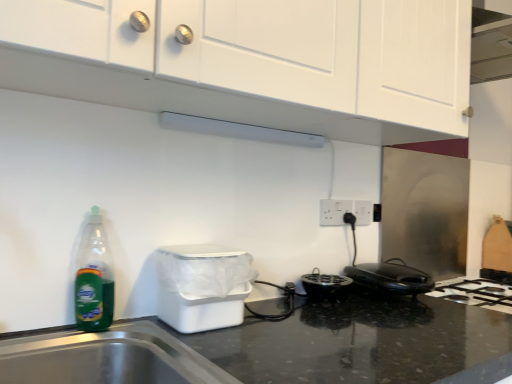
Question: From the image's perspective, does white plastic trash bin at lower left appear higher than white matte cabinet at upper center?

Choices:
 (A) yes
 (B) no

Answer: (B)

Question: Does white plastic trash bin at lower left come behind white matte cabinet at upper center?

Choices:
 (A) yes
 (B) no

Answer: (A)

Question: Can you confirm if white plastic trash bin at lower left is wider than white matte cabinet at upper center?

Choices:
 (A) yes
 (B) no

Answer: (B)

Question: From a real-world perspective, is white plastic trash bin at lower left located higher than white matte cabinet at upper center?

Choices:
 (A) yes
 (B) no

Answer: (B)

Question: From a real-world perspective, is white plastic trash bin at lower left located beneath white matte cabinet at upper center?

Choices:
 (A) yes
 (B) no

Answer: (A)

Question: Considering the relative positions of white plastic trash bin at lower left and white matte cabinet at upper center in the image provided, is white plastic trash bin at lower left to the left of white matte cabinet at upper center from the viewer's perspective?

Choices:
 (A) yes
 (B) no

Answer: (A)

Question: Is green translucent bottle at left not inside white matte exhaust hood at upper center?

Choices:
 (A) yes
 (B) no

Answer: (A)

Question: Is green translucent bottle at left bigger than white matte exhaust hood at upper center?

Choices:
 (A) yes
 (B) no

Answer: (A)

Question: Is green translucent bottle at left oriented towards white matte exhaust hood at upper center?

Choices:
 (A) yes
 (B) no

Answer: (B)

Question: Is green translucent bottle at left looking in the opposite direction of white matte exhaust hood at upper center?

Choices:
 (A) no
 (B) yes

Answer: (A)

Question: Can you confirm if green translucent bottle at left is thinner than white matte exhaust hood at upper center?

Choices:
 (A) no
 (B) yes

Answer: (A)

Question: Is green translucent bottle at left positioned far away from white matte exhaust hood at upper center?

Choices:
 (A) yes
 (B) no

Answer: (B)

Question: From the image's perspective, does white matte exhaust hood at upper center appear higher than black plastic toaster at lower right?

Choices:
 (A) yes
 (B) no

Answer: (A)